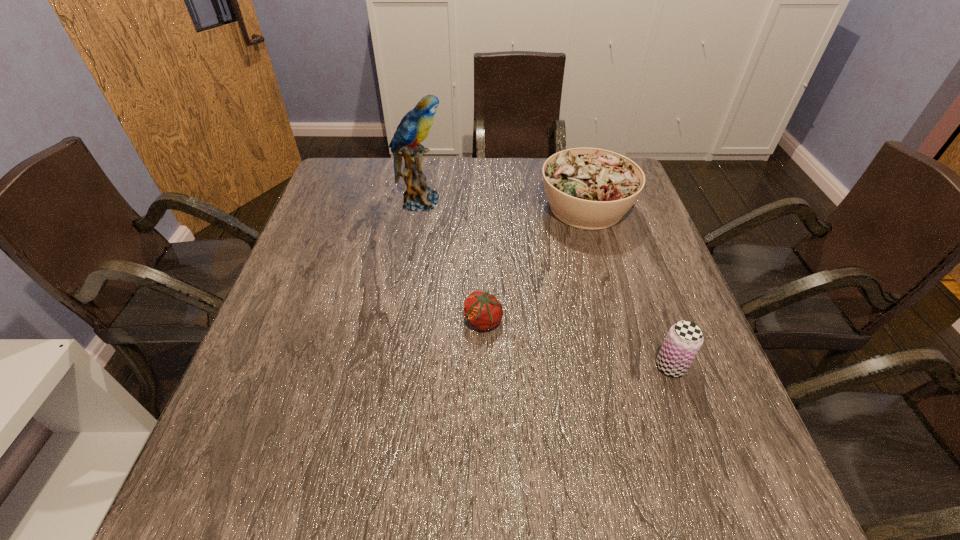
At what (x,y) coordinates should I click in order to perform the action: click on free point between the nearest object and the salad. Please return your answer as a coordinate pair (x, y). Looking at the image, I should click on (629, 287).

Where is `object that is the closest to the salad`? This screenshot has height=540, width=960. object that is the closest to the salad is located at coordinates (483, 311).

Select which object appears as the third closest to the beer can. Please provide its 2D coordinates. Your answer should be formatted as a tuple, i.e. [(x, y)], where the tuple contains the x and y coordinates of a point satisfying the conditions above.

[(414, 127)]

Locate an element on the screen. The height and width of the screenshot is (540, 960). vacant space that satisfies the following two spatial constraints: 1. on the face of the nearest object; 2. on the left side of the tallest object is located at coordinates (393, 366).

The height and width of the screenshot is (540, 960). What are the coordinates of `free location that satisfies the following two spatial constraints: 1. on the back side of the salad; 2. on the left side of the tomato` in the screenshot? It's located at (483, 207).

This screenshot has width=960, height=540. What are the coordinates of `vacant point that satisfies the following two spatial constraints: 1. on the face of the shortest object; 2. on the left side of the tallest object` in the screenshot? It's located at (400, 321).

The width and height of the screenshot is (960, 540). What are the coordinates of `free location that satisfies the following two spatial constraints: 1. on the face of the beer can; 2. on the right side of the leftmost object` in the screenshot? It's located at (393, 366).

The image size is (960, 540). Find the location of `free location that satisfies the following two spatial constraints: 1. on the face of the leftmost object; 2. on the right side of the salad`. free location that satisfies the following two spatial constraints: 1. on the face of the leftmost object; 2. on the right side of the salad is located at coordinates (419, 207).

Locate an element on the screen. vacant space that satisfies the following two spatial constraints: 1. on the face of the nearest object; 2. on the right side of the tallest object is located at coordinates tap(393, 366).

Where is `vacant space that satisfies the following two spatial constraints: 1. on the back side of the beer can; 2. on the face of the leftmost object`? Image resolution: width=960 pixels, height=540 pixels. vacant space that satisfies the following two spatial constraints: 1. on the back side of the beer can; 2. on the face of the leftmost object is located at coordinates (612, 201).